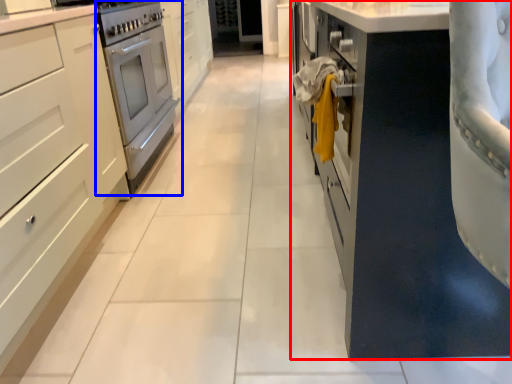
Question: Which point is closer to the camera, cabinetry (highlighted by a red box) or home appliance (highlighted by a blue box)?

Choices:
 (A) cabinetry
 (B) home appliance

Answer: (A)